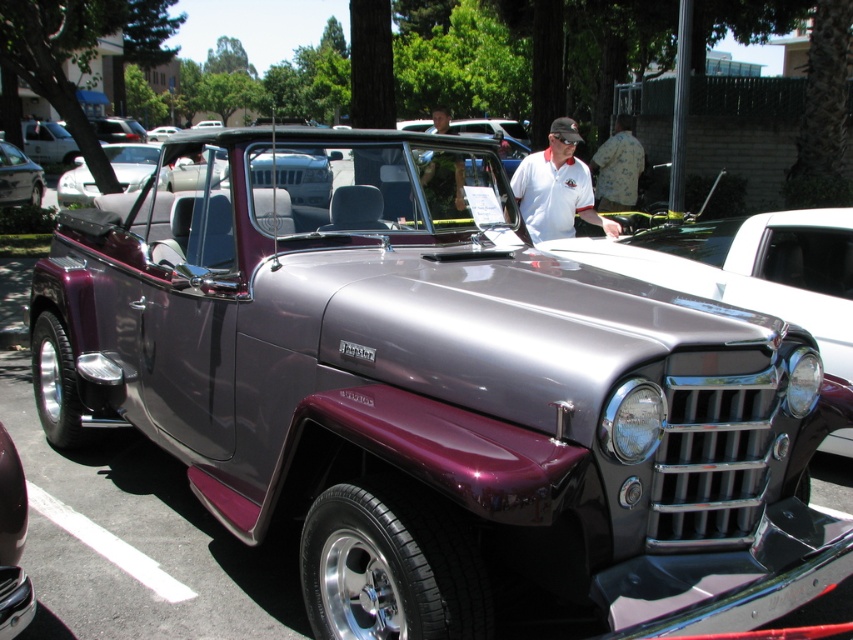
Is white cotton shirt at center to the right of camouflage fabric shirt at center from the viewer's perspective?

Yes, white cotton shirt at center is to the right of camouflage fabric shirt at center.

Where is `white cotton shirt at center`? white cotton shirt at center is located at coordinates (x=556, y=188).

Identify the location of white cotton shirt at center. (556, 188).

Between point (837, 292) and point (4, 193), which one is positioned behind?

The point (4, 193) is behind.

Is point (589, 260) less distant than point (20, 150)?

Yes, point (589, 260) is closer to viewer.

This screenshot has width=853, height=640. I want to click on metallic purple pickup truck at center, so [x=747, y=268].

Can you confirm if metallic purple pickup truck at center is bigger than camouflage fabric shirt at center?

No, metallic purple pickup truck at center is not bigger than camouflage fabric shirt at center.

Between metallic purple pickup truck at center and camouflage fabric shirt at center, which one has less height?

metallic purple pickup truck at center

Who is more forward, (840, 276) or (467, 214)?

Point (467, 214) is in front.

Locate an element on the screen. metallic purple pickup truck at center is located at coordinates (747, 268).